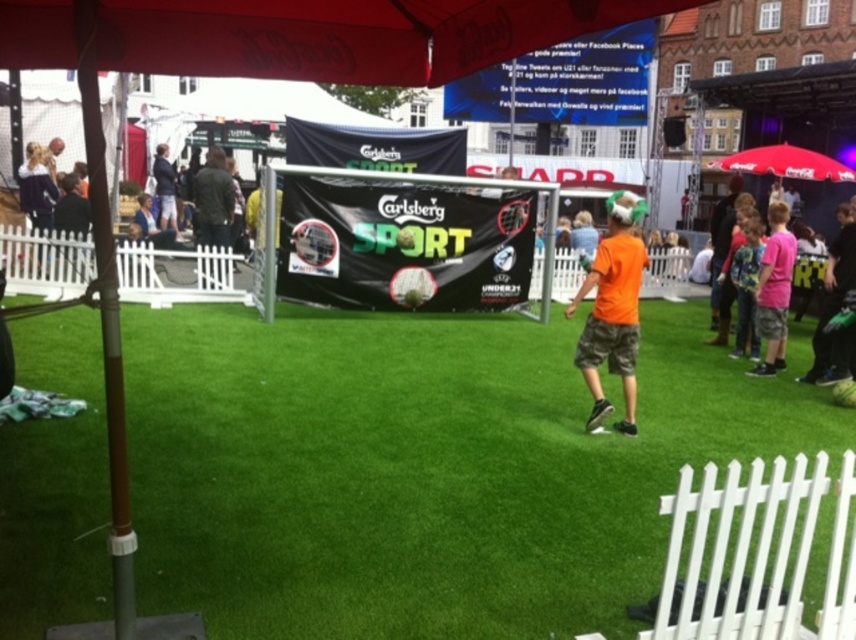
You are a photographer at the event and need to capture a clear shot of both the orange matte shirt at center and the light blue denim shorts at center. Based on their positions, which one should you focus on first to ensure both are in focus?

The orange matte shirt at center is in front of the light blue denim shorts at center. To ensure both are in focus, you should focus on the orange matte shirt at center first, as it is closer to the camera, allowing the shorts behind it to remain in focus through depth of field.